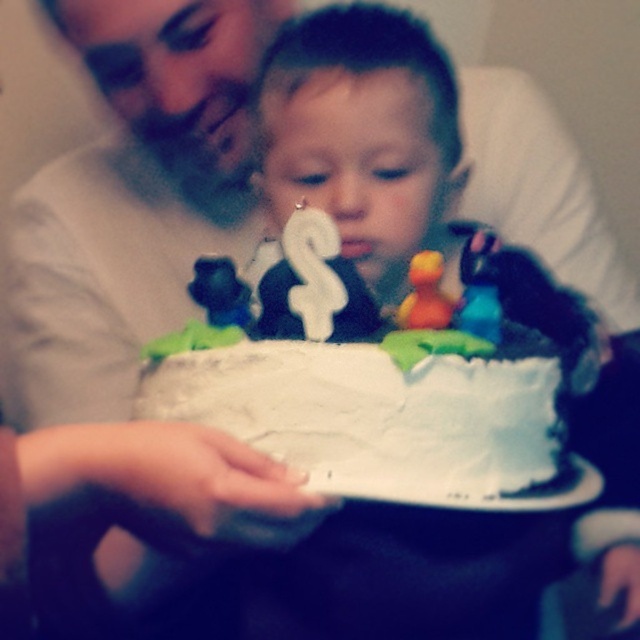
Who is positioned more to the left, white frosted cake at center or white smooth frosting at center?

From the viewer's perspective, white smooth frosting at center appears more on the left side.

Between point (417, 467) and point (449, 355), which one is positioned behind?

The point (449, 355) is more distant.

Is point (342, 378) farther from viewer compared to point (461, 358)?

That is False.

Where is `white frosted cake at center`? This screenshot has width=640, height=640. white frosted cake at center is located at coordinates (369, 388).

Who is more distant from viewer, [193,214] or [412,490]?

The point [193,214] is more distant.

Does matte white shirt at upper left have a smaller size compared to white smooth frosting at center?

A: Incorrect, matte white shirt at upper left is not smaller in size than white smooth frosting at center.

Does point (76, 218) come closer to viewer compared to point (532, 476)?

No.

Where is `matte white shirt at upper left`? The image size is (640, 640). matte white shirt at upper left is located at coordinates (131, 200).

Describe the element at coordinates (131, 200) in the screenshot. I see `matte white shirt at upper left` at that location.

Can you confirm if matte white shirt at upper left is smaller than white frosted cake at center?

Incorrect, matte white shirt at upper left is not smaller in size than white frosted cake at center.

Which is in front, point (131, 74) or point (472, 385)?

Point (472, 385) is more forward.

Find the location of a particular element. matte white shirt at upper left is located at coordinates (131, 200).